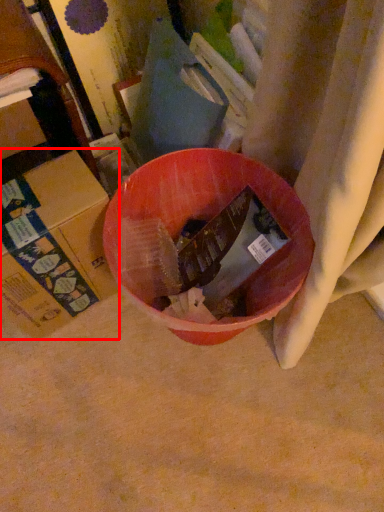
Question: In this image, where is cardboard box (annotated by the red box) located relative to cardboard box?

Choices:
 (A) right
 (B) left

Answer: (A)